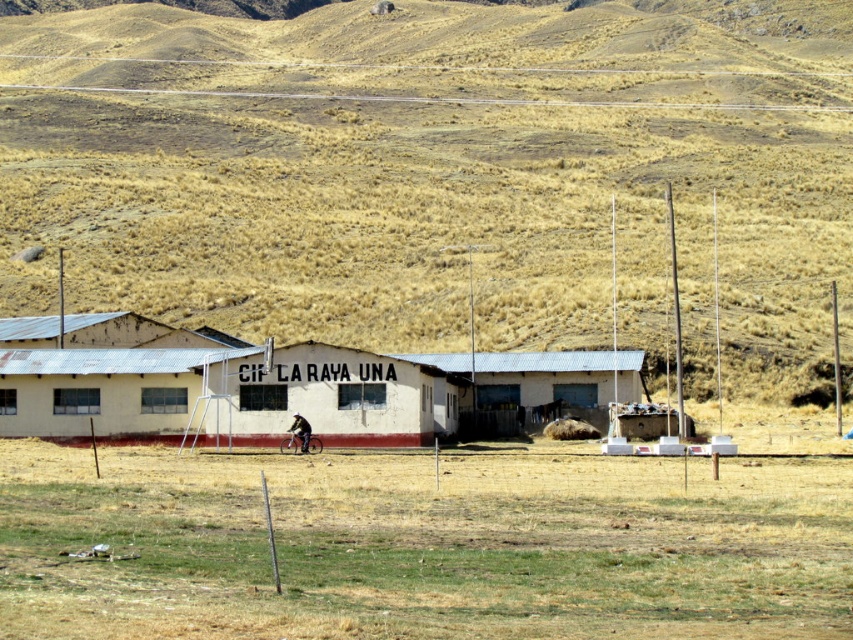
Question: Does brown grassy hillside at upper center have a lesser width compared to white corrugated metal building at center?

Choices:
 (A) no
 (B) yes

Answer: (A)

Question: Can you confirm if brown grassy hillside at upper center is thinner than green grass at center?

Choices:
 (A) no
 (B) yes

Answer: (A)

Question: Where is brown grassy hillside at upper center located in relation to white corrugated metal building at center in the image?

Choices:
 (A) left
 (B) right

Answer: (B)

Question: Which point is farther to the camera?

Choices:
 (A) (838, 566)
 (B) (79, 372)

Answer: (B)

Question: Which point is closer to the camera taking this photo?

Choices:
 (A) (96, 280)
 (B) (314, 417)
 (C) (437, 568)

Answer: (C)

Question: Which is nearer to the green grass at center?

Choices:
 (A) brown grassy hillside at upper center
 (B) white corrugated metal building at center

Answer: (B)